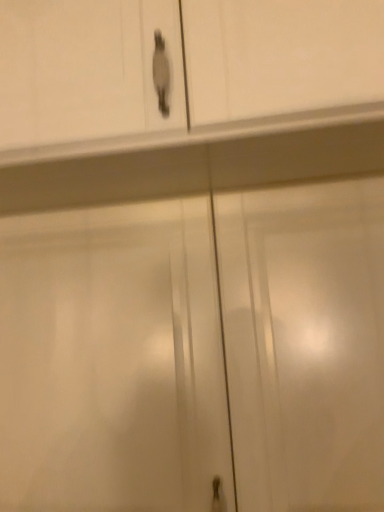
Where is `matte white cabinet at upper center`? matte white cabinet at upper center is located at coordinates (84, 70).

What is the approximate width of matte white cabinet at upper center?

25.01 inches.

The image size is (384, 512). Describe the element at coordinates (84, 70) in the screenshot. I see `matte white cabinet at upper center` at that location.

What are the coordinates of `white glossy cabinet doors at center` in the screenshot? It's located at (112, 360).

Image resolution: width=384 pixels, height=512 pixels. Describe the element at coordinates (112, 360) in the screenshot. I see `white glossy cabinet doors at center` at that location.

Image resolution: width=384 pixels, height=512 pixels. In order to click on matte white cabinet at upper center in this screenshot , I will do `click(84, 70)`.

Based on their positions, is white glossy cabinet doors at center located to the left or right of matte white cabinet at upper center?

Clearly, white glossy cabinet doors at center is on the right of matte white cabinet at upper center in the image.

Which object is closer to the camera taking this photo, white glossy cabinet doors at center or matte white cabinet at upper center?

Positioned in front is matte white cabinet at upper center.

Does point (177, 388) come behind point (303, 89)?

Yes, point (177, 388) is farther from viewer.

From the image's perspective, is white glossy cabinet doors at center beneath matte white cabinet at upper center?

Indeed, from the image's perspective, white glossy cabinet doors at center is shown beneath matte white cabinet at upper center.

From a real-world perspective, which is physically below, white glossy cabinet doors at center or matte white cabinet at upper center?

In real-world perspective, white glossy cabinet doors at center is lower.

Considering the sizes of objects white glossy cabinet doors at center and matte white cabinet at upper center in the image provided, who is thinner, white glossy cabinet doors at center or matte white cabinet at upper center?

white glossy cabinet doors at center.

Considering the relative sizes of white glossy cabinet doors at center and matte white cabinet at upper center in the image provided, is white glossy cabinet doors at center taller than matte white cabinet at upper center?

Correct, white glossy cabinet doors at center is much taller as matte white cabinet at upper center.

Is white glossy cabinet doors at center bigger than matte white cabinet at upper center?

No.

Is matte white cabinet at upper center completely or partially inside white glossy cabinet doors at center?

That's incorrect, matte white cabinet at upper center is not inside white glossy cabinet doors at center.

Is white glossy cabinet doors at center next to matte white cabinet at upper center?

They are not placed beside each other.

Is white glossy cabinet doors at center turned away from matte white cabinet at upper center?

No, white glossy cabinet doors at center's orientation is not away from matte white cabinet at upper center.

How different are the orientations of white glossy cabinet doors at center and matte white cabinet at upper center in degrees?

The facing directions of white glossy cabinet doors at center and matte white cabinet at upper center are 7.8e-05 degrees apart.

How far apart are white glossy cabinet doors at center and matte white cabinet at upper center?

white glossy cabinet doors at center and matte white cabinet at upper center are 13.44 inches apart from each other.

You are a GUI agent. You are given a task and a screenshot of the screen. Output one action in this format:
    pyautogui.click(x=<x>, y=<y>)
    Task: Click on the cabinetry in front of the white glossy cabinet doors at center
    
    Given the screenshot: What is the action you would take?
    pyautogui.click(x=84, y=70)

Which is more to the left, matte white cabinet at upper center or white glossy cabinet doors at center?

matte white cabinet at upper center is more to the left.

Looking at this image, which object is further away from the camera, matte white cabinet at upper center or white glossy cabinet doors at center?

white glossy cabinet doors at center.

Looking at this image, which is farther from the camera, (94, 13) or (139, 340)?

The point (139, 340) is farther.

From the image's perspective, relative to white glossy cabinet doors at center, is matte white cabinet at upper center above or below?

Based on their image positions, matte white cabinet at upper center is located above white glossy cabinet doors at center.

From a real-world perspective, is matte white cabinet at upper center physically below white glossy cabinet doors at center?

No.

Is matte white cabinet at upper center thinner than white glossy cabinet doors at center?

In fact, matte white cabinet at upper center might be wider than white glossy cabinet doors at center.

Consider the image. In terms of height, does matte white cabinet at upper center look taller or shorter compared to white glossy cabinet doors at center?

Considering their sizes, matte white cabinet at upper center has less height than white glossy cabinet doors at center.

Does matte white cabinet at upper center have a smaller size compared to white glossy cabinet doors at center?

No, matte white cabinet at upper center is not smaller than white glossy cabinet doors at center.

Is matte white cabinet at upper center inside or outside of white glossy cabinet doors at center?

matte white cabinet at upper center exists outside the volume of white glossy cabinet doors at center.

Is matte white cabinet at upper center placed right next to white glossy cabinet doors at center?

No.

Is matte white cabinet at upper center oriented away from white glossy cabinet doors at center?

That's not correct — matte white cabinet at upper center is not looking away from white glossy cabinet doors at center.

Find the location of a particular element. The image size is (384, 512). cabinetry located on the left of white glossy cabinet doors at center is located at coordinates (84, 70).

At what (x,y) coordinates should I click in order to perform the action: click on screen door on the right of the matte white cabinet at upper center. Please return your answer as a coordinate pair (x, y). Image resolution: width=384 pixels, height=512 pixels. Looking at the image, I should click on (112, 360).

The width and height of the screenshot is (384, 512). In order to click on screen door below the matte white cabinet at upper center (from the image's perspective) in this screenshot , I will do `click(112, 360)`.